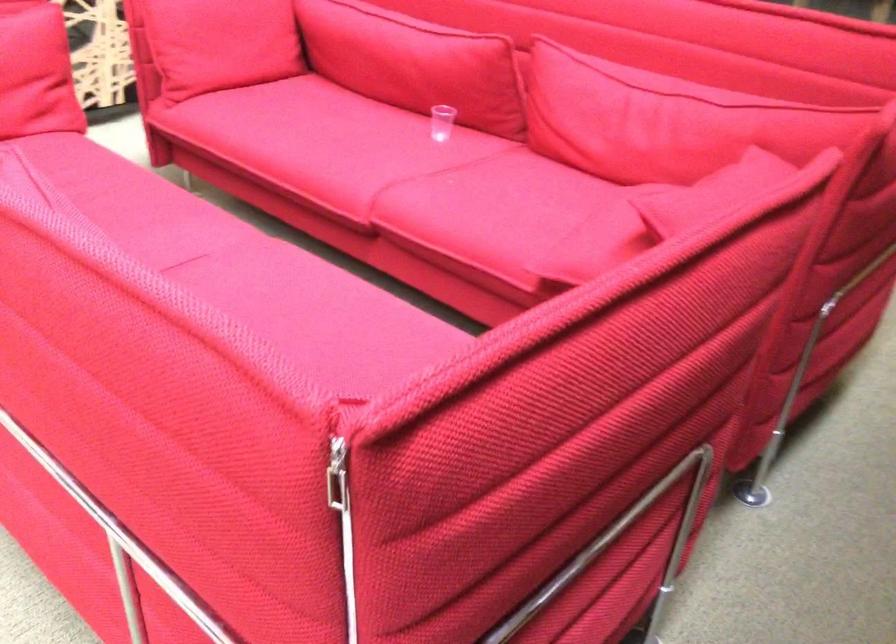
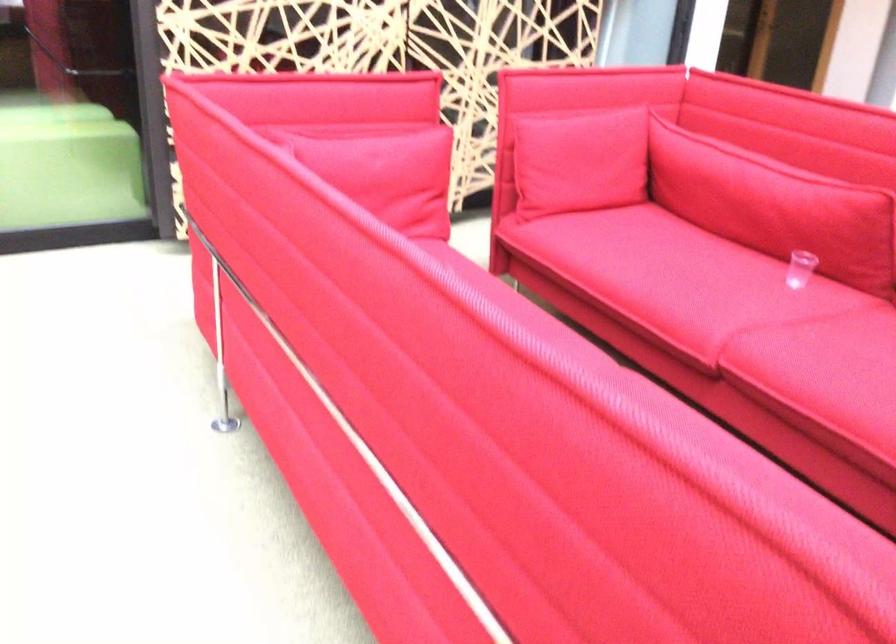
Question: How did the camera likely rotate?

Choices:
 (A) Left
 (B) Right
 (C) Up
 (D) Down

Answer: (A)